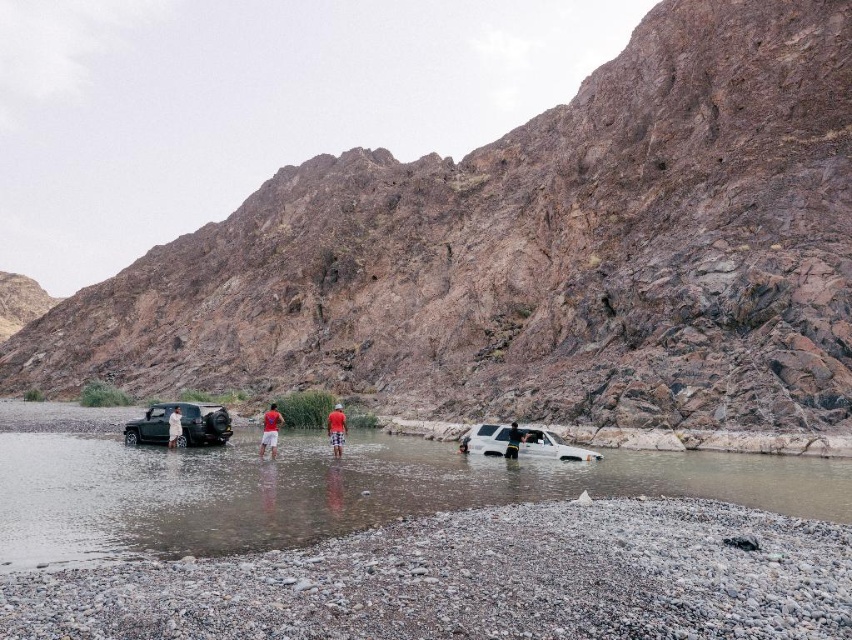
Question: Which object is farther from the camera taking this photo?

Choices:
 (A) white matte car at lower center
 (B) red plaid shorts at center
 (C) white matte suv at center
 (D) clear water at center

Answer: (B)

Question: Among these objects, which one is farthest from the camera?

Choices:
 (A) shiny black jeep at lower left
 (B) white matte car at lower center
 (C) red cotton shirt at center
 (D) clear water at center

Answer: (A)

Question: Is white matte suv at center further to the viewer compared to red cotton shirt at center?

Choices:
 (A) yes
 (B) no

Answer: (B)

Question: Which is nearer to the red plaid shorts at center?

Choices:
 (A) red cotton shirt at center
 (B) shiny black jeep at lower left
 (C) white matte car at lower center

Answer: (A)

Question: Does shiny black jeep at lower left have a lesser width compared to red cotton shirt at center?

Choices:
 (A) no
 (B) yes

Answer: (A)

Question: Does red cotton shirt at center come in front of white matte car at lower center?

Choices:
 (A) yes
 (B) no

Answer: (B)